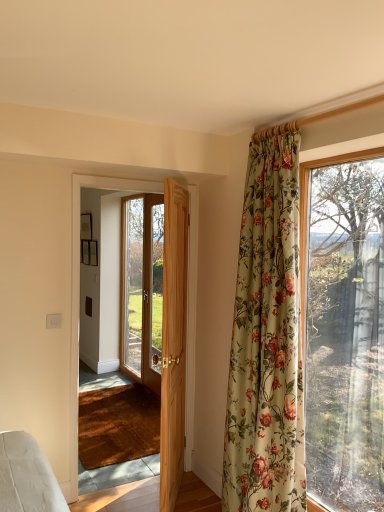
How much space does wooden door at center, which is counted as the third door, starting from the front, occupy vertically?

wooden door at center, which is counted as the third door, starting from the front, is 7.12 feet in height.

Where is `floral fabric curtain at right`? The height and width of the screenshot is (512, 384). floral fabric curtain at right is located at coordinates (267, 340).

Would you say floral fabric curtain at right is a long distance from wooden door at center, which ranks as the second door in back-to-front order?

That's not correct — floral fabric curtain at right is a little close to wooden door at center, which ranks as the second door in back-to-front order.

Can you confirm if floral fabric curtain at right is thinner than wooden door at center, which ranks as the second door in back-to-front order?

In fact, floral fabric curtain at right might be wider than wooden door at center, which ranks as the second door in back-to-front order.

Is point (237, 435) positioned in front of point (190, 260)?

Yes, point (237, 435) is closer to viewer.

Locate an element on the screen. The height and width of the screenshot is (512, 384). curtain that appears above the wooden door at center, the second door when ordered from front to back (from the image's perspective) is located at coordinates (267, 340).

Locate an element on the screen. Image resolution: width=384 pixels, height=512 pixels. door in front of the wooden door at center, which ranks as the second door in back-to-front order is located at coordinates (173, 342).

Based on the photo, from a real-world perspective, is light brown wooden door at center, the 3th door in the back-to-front sequence, located beneath wooden door at center, the second door when ordered from front to back?

Yes, from a real-world perspective, light brown wooden door at center, the 3th door in the back-to-front sequence, is beneath wooden door at center, the second door when ordered from front to back.

Does light brown wooden door at center, the 3th door in the back-to-front sequence, lie in front of wooden door at center, the second door when ordered from front to back?

Yes, it is in front of wooden door at center, the second door when ordered from front to back.

Consider the image. Would you say light brown wooden door at center, the 3th door in the back-to-front sequence, contains wooden door at center, the second door when ordered from front to back?

No, wooden door at center, the second door when ordered from front to back, is not surrounded by light brown wooden door at center, the 3th door in the back-to-front sequence.

Between wooden door at center, the second door when ordered from front to back, and floral fabric curtain at right, which one has more height?

floral fabric curtain at right is taller.

From the picture: Considering the positions of objects wooden door at center, which ranks as the second door in back-to-front order, and floral fabric curtain at right in the image provided, who is in front, wooden door at center, which ranks as the second door in back-to-front order, or floral fabric curtain at right?

floral fabric curtain at right is closer to the camera.

From a real-world perspective, is wooden door at center, the second door when ordered from front to back, positioned above or below floral fabric curtain at right?

In terms of real-world spatial position, wooden door at center, the second door when ordered from front to back, is below floral fabric curtain at right.

Is floral fabric curtain at right wider than light brown wooden door at center, the 3th door in the back-to-front sequence?

Yes, floral fabric curtain at right is wider than light brown wooden door at center, the 3th door in the back-to-front sequence.

Looking at this image, which point is more distant from viewer, (294,416) or (163,496)?

Point (163,496)

Is light brown wooden door at center, the 1th door viewed from the front, located within floral fabric curtain at right?

No, floral fabric curtain at right does not contain light brown wooden door at center, the 1th door viewed from the front.

In terms of width, does wooden door at center, the second door when ordered from front to back, look wider or thinner when compared to wooden door at center, which is counted as the third door, starting from the front?

In the image, wooden door at center, the second door when ordered from front to back, appears to be more narrow than wooden door at center, which is counted as the third door, starting from the front.

Does wooden door at center, which ranks as the second door in back-to-front order, turn towards wooden door at center, marked as the first door in a back-to-front arrangement?

No.

From a real-world perspective, who is located lower, wooden door at center, the second door when ordered from front to back, or wooden door at center, marked as the first door in a back-to-front arrangement?

In real-world perspective, wooden door at center, the second door when ordered from front to back, is lower.

Is wooden door at center, which ranks as the second door in back-to-front order, taller or shorter than wooden door at center, marked as the first door in a back-to-front arrangement?

Clearly, wooden door at center, which ranks as the second door in back-to-front order, is shorter compared to wooden door at center, marked as the first door in a back-to-front arrangement.

Which object is positioned more to the right, wooden door at center, which ranks as the second door in back-to-front order, or light brown wooden door at center, the 1th door viewed from the front?

Positioned to the right is light brown wooden door at center, the 1th door viewed from the front.

I want to click on door directly beneath the wooden door at center, which ranks as the second door in back-to-front order (from a real-world perspective), so click(x=173, y=342).

Considering the positions of points (195, 226) and (163, 296), is point (195, 226) farther from camera compared to point (163, 296)?

Yes.

From the image's perspective, is wooden door at center, the second door when ordered from front to back, over light brown wooden door at center, the 1th door viewed from the front?

Yes.

Can you tell me how much wooden door at center, which is counted as the third door, starting from the front, and floral fabric curtain at right differ in facing direction?

The angle between the facing direction of wooden door at center, which is counted as the third door, starting from the front, and the facing direction of floral fabric curtain at right is 1.08 degrees.

How far apart are wooden door at center, which is counted as the third door, starting from the front, and floral fabric curtain at right?

wooden door at center, which is counted as the third door, starting from the front, is 7.56 feet away from floral fabric curtain at right.

The width and height of the screenshot is (384, 512). I want to click on curtain on the right of wooden door at center, which is counted as the third door, starting from the front, so click(x=267, y=340).

Does wooden door at center, which is counted as the third door, starting from the front, appear on the left side of floral fabric curtain at right?

Yes.

Locate an element on the screen. This screenshot has width=384, height=512. curtain above the wooden door at center, the second door when ordered from front to back (from a real-world perspective) is located at coordinates (267, 340).

From the image's perspective, count 1st doors upward from the light brown wooden door at center, the 1th door viewed from the front, and point to it. Please provide its 2D coordinates.

[(79, 291)]

Based on their spatial positions, is light brown wooden door at center, the 1th door viewed from the front, or wooden door at center, which is counted as the third door, starting from the front, further from wooden door at center, which ranks as the second door in back-to-front order?

wooden door at center, which is counted as the third door, starting from the front, lies further to wooden door at center, which ranks as the second door in back-to-front order, than the other object.

From the image, which object appears to be nearer to floral fabric curtain at right, wooden door at center, the second door when ordered from front to back, or light brown wooden door at center, the 3th door in the back-to-front sequence?

light brown wooden door at center, the 3th door in the back-to-front sequence, is closer to floral fabric curtain at right.

Considering their positions, is wooden door at center, which ranks as the second door in back-to-front order, positioned closer to wooden door at center, which is counted as the third door, starting from the front, than light brown wooden door at center, the 3th door in the back-to-front sequence?

Among the two, wooden door at center, which ranks as the second door in back-to-front order, is located nearer to wooden door at center, which is counted as the third door, starting from the front.

When comparing their distances from light brown wooden door at center, the 3th door in the back-to-front sequence, does wooden door at center, marked as the first door in a back-to-front arrangement, or floral fabric curtain at right seem closer?

floral fabric curtain at right lies closer to light brown wooden door at center, the 3th door in the back-to-front sequence, than the other object.

When comparing their distances from wooden door at center, marked as the first door in a back-to-front arrangement, does floral fabric curtain at right or wooden door at center, which ranks as the second door in back-to-front order, seem closer?

Based on the image, wooden door at center, which ranks as the second door in back-to-front order, appears to be nearer to wooden door at center, marked as the first door in a back-to-front arrangement.

Estimate the real-world distances between objects in this image. Which object is closer to light brown wooden door at center, the 3th door in the back-to-front sequence, wooden door at center, which ranks as the second door in back-to-front order, or wooden door at center, which is counted as the third door, starting from the front?

wooden door at center, which ranks as the second door in back-to-front order, lies closer to light brown wooden door at center, the 3th door in the back-to-front sequence, than the other object.

Based on their spatial positions, is light brown wooden door at center, the 1th door viewed from the front, or floral fabric curtain at right further from wooden door at center, which ranks as the second door in back-to-front order?

floral fabric curtain at right.

When comparing their distances from wooden door at center, marked as the first door in a back-to-front arrangement, does light brown wooden door at center, the 3th door in the back-to-front sequence, or floral fabric curtain at right seem closer?

Based on the image, light brown wooden door at center, the 3th door in the back-to-front sequence, appears to be nearer to wooden door at center, marked as the first door in a back-to-front arrangement.

This screenshot has height=512, width=384. I want to click on door between light brown wooden door at center, the 1th door viewed from the front, and wooden door at center, marked as the first door in a back-to-front arrangement, in the front-back direction, so click(79, 291).

Where is `door between wooden door at center, the second door when ordered from front to back, and floral fabric curtain at right`? door between wooden door at center, the second door when ordered from front to back, and floral fabric curtain at right is located at coordinates (173, 342).